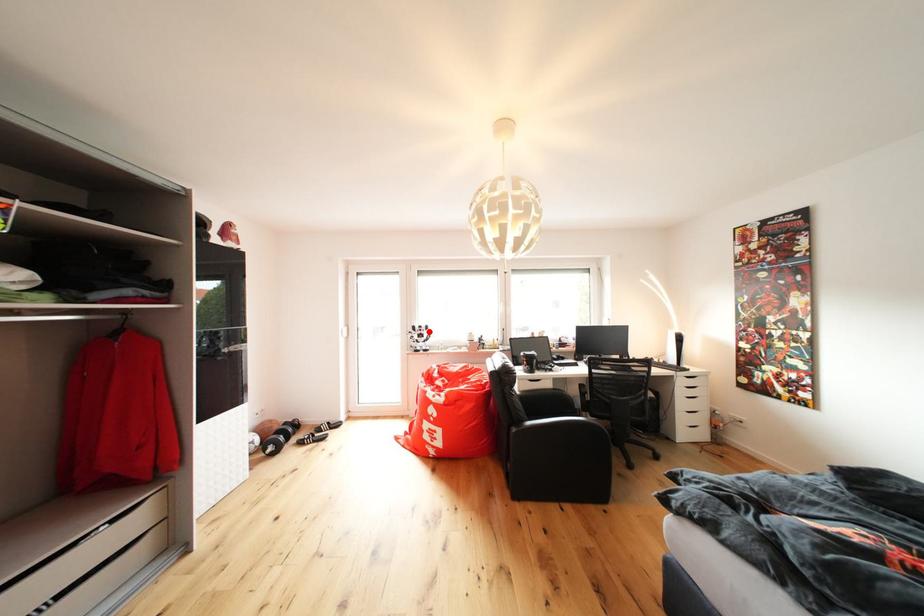
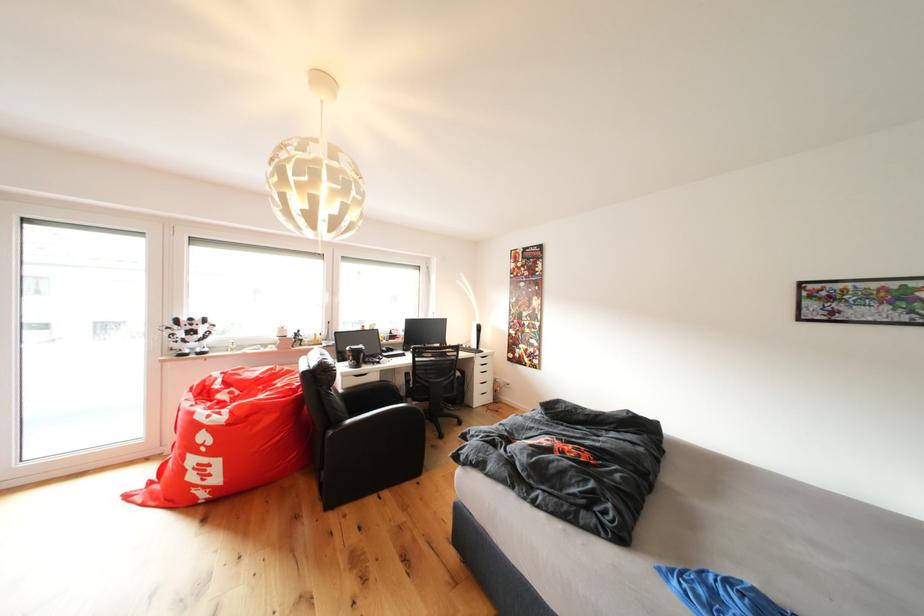
The point at the highlighted location is marked in the first image. Where is the corresponding point in the second image?

(200, 323)